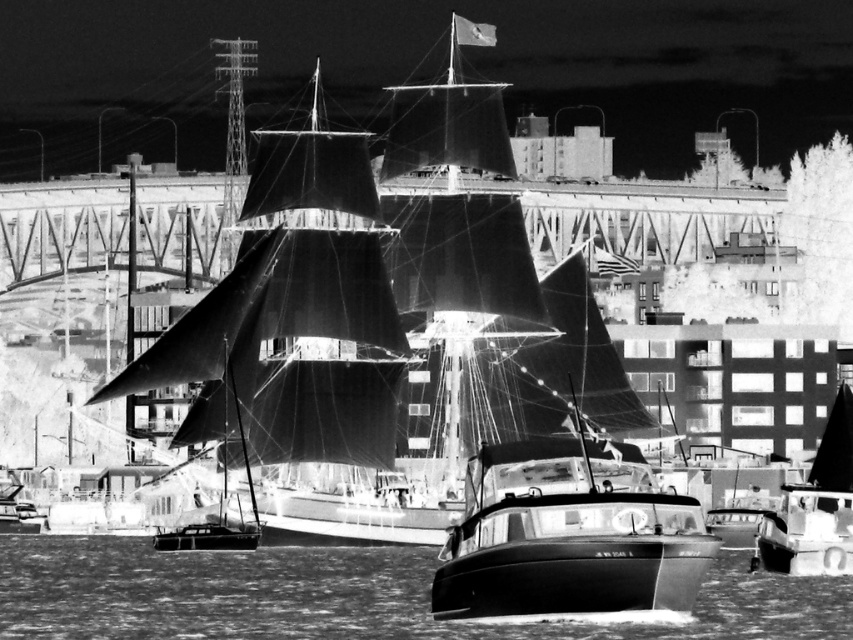
You are a photographer trying to capture the width of the translucent water at lower center and the smooth black sailboat at center in the image. Based on the scene, which object appears wider?

The translucent water at lower center might be wider than the smooth black sailboat at center.